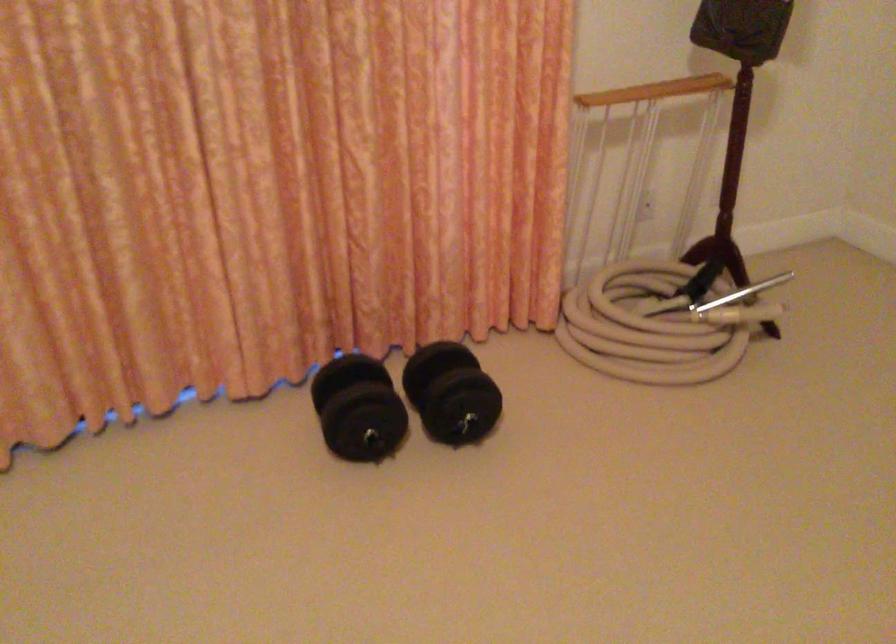
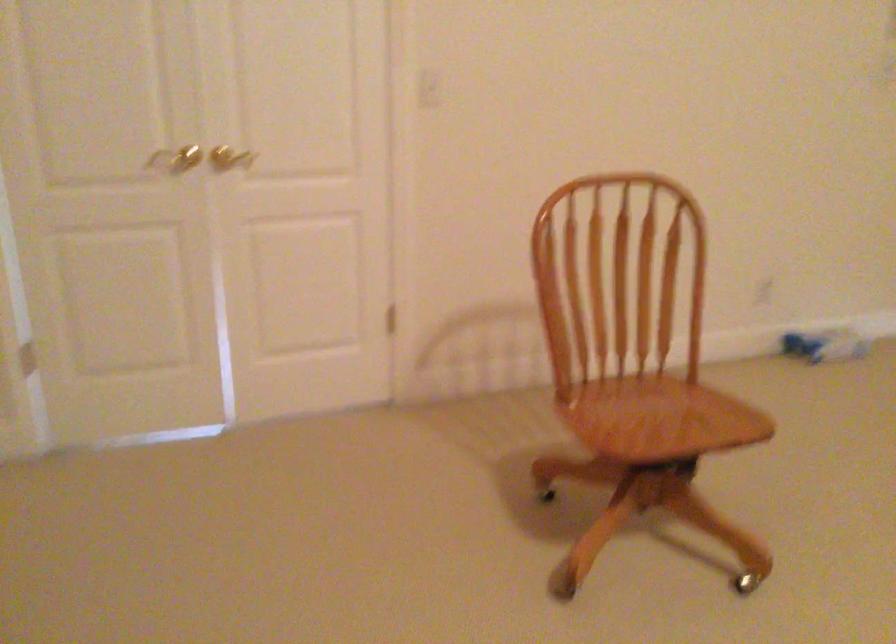
Question: Based on the continuous images, in which direction is the camera rotating? Reply with the corresponding letter.

Choices:
 (A) Left
 (B) Right
 (C) Up
 (D) Down

Answer: (B)